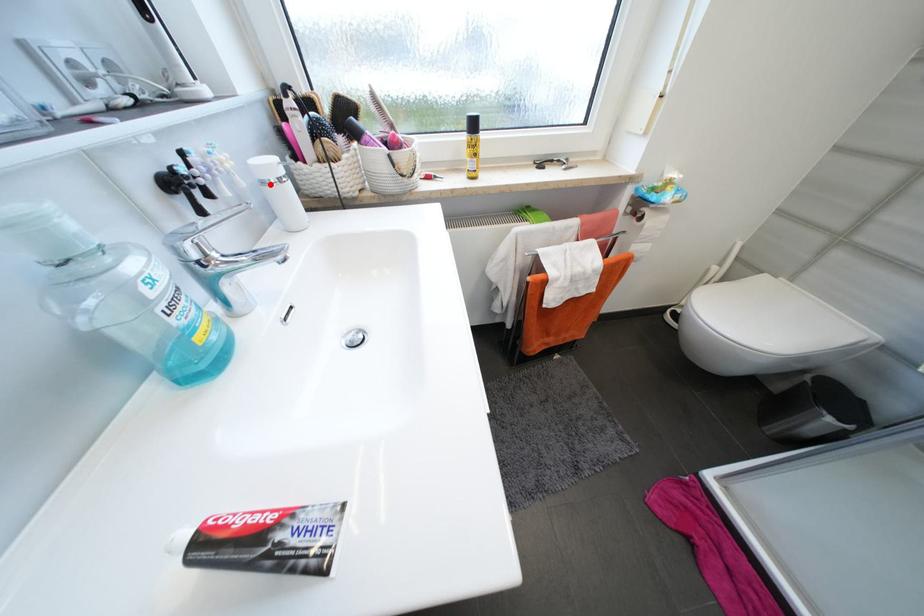
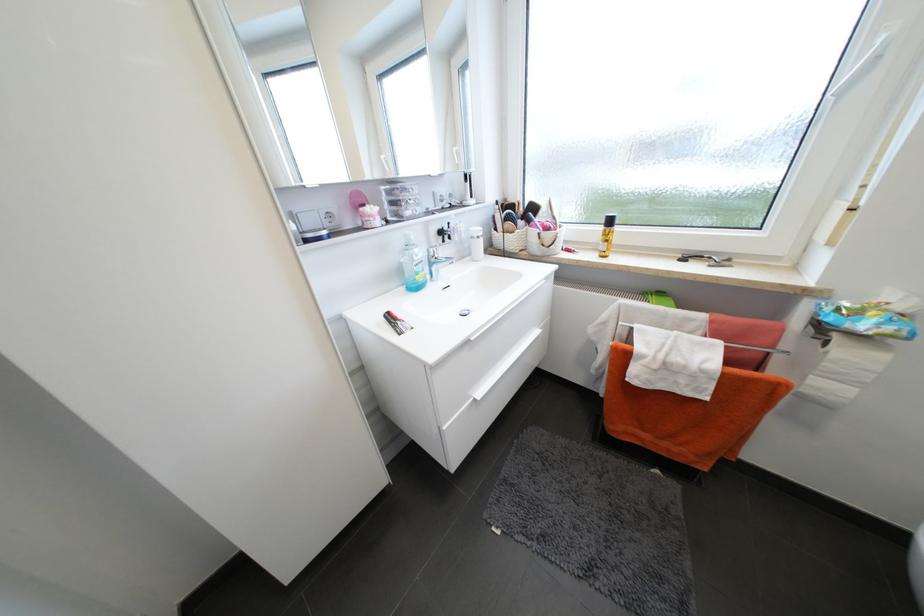
In the second image, find the point that corresponds to the highlighted location in the first image.

(478, 238)